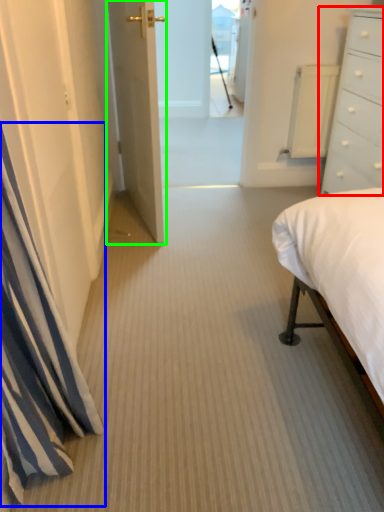
Question: Considering the real-world distances, which object is farthest from chest of drawers (highlighted by a red box)? curtain (highlighted by a blue box) or door (highlighted by a green box)?

Choices:
 (A) curtain
 (B) door

Answer: (A)